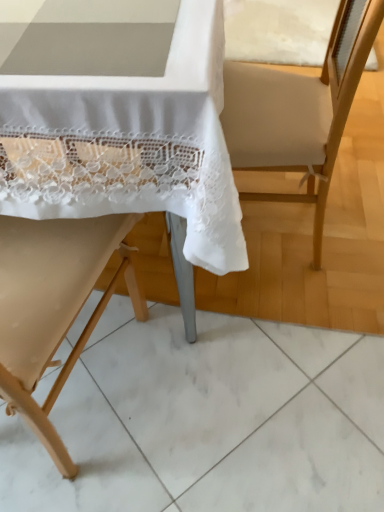
The image size is (384, 512). I want to click on space that is in front of beige fabric armchair at center, so click(264, 336).